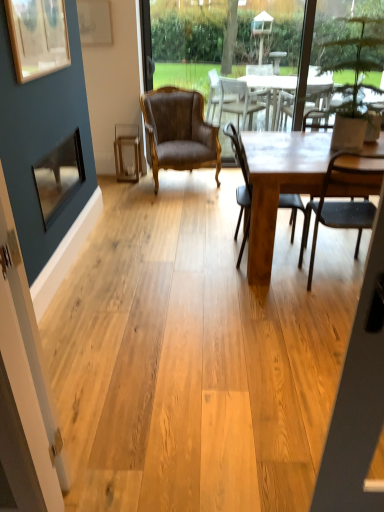
You are a GUI agent. You are given a task and a screenshot of the screen. Output one action in this format:
    pyautogui.click(x=<x>, y=<y>)
    Task: Click on the spots to the right of transparent glass screen door at left
    This screenshot has height=512, width=384.
    Given the screenshot: What is the action you would take?
    pyautogui.click(x=101, y=485)